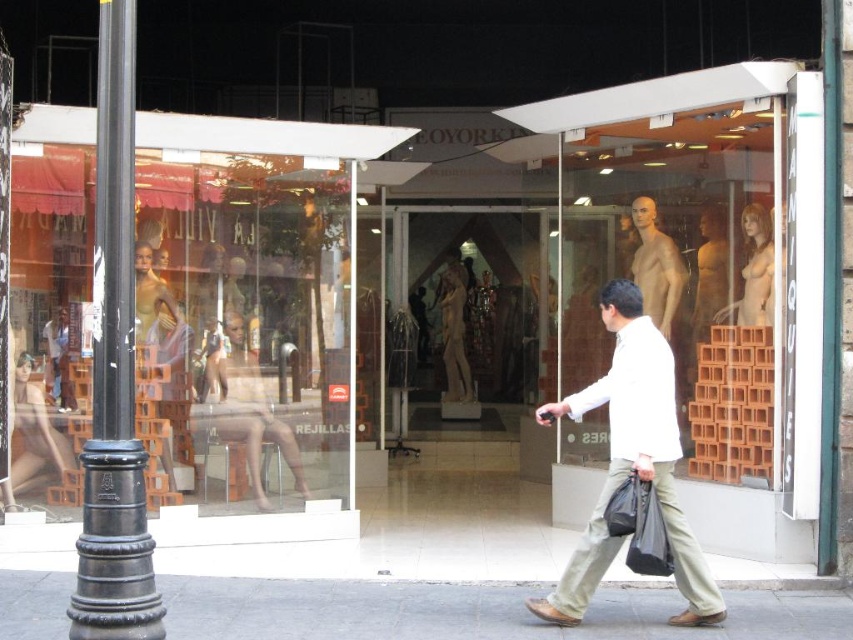
Question: Which is nearer to the clear glass mannequins at left?

Choices:
 (A) matte beige dress at center
 (B) black polished metal pole at left

Answer: (B)

Question: Which of the following is the farthest from the observer?

Choices:
 (A) smooth skin figure at center
 (B) clear glass mannequins at left

Answer: (A)

Question: Can you confirm if gray concrete sidewalk at lower center is positioned to the left of smooth skin figure at center?

Choices:
 (A) no
 (B) yes

Answer: (A)

Question: Is smooth beige mannequin at center closer to the viewer compared to matte beige dress at center?

Choices:
 (A) yes
 (B) no

Answer: (A)

Question: Does white matte shirt at center appear over matte beige dress at center?

Choices:
 (A) no
 (B) yes

Answer: (A)

Question: Which of these objects is positioned farthest from the white matte shirt at center?

Choices:
 (A) smooth beige mannequin at center
 (B) clear glass mannequins at left
 (C) matte beige dress at center
 (D) gray concrete sidewalk at lower center

Answer: (C)